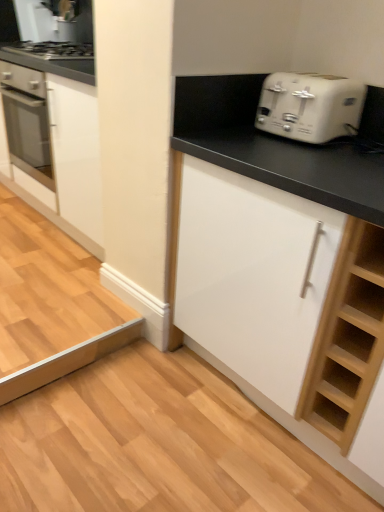
Question: Is there a large distance between white plastic toaster at upper right and white matte cabinet at center, which ranks as the first cabinetry in front-to-back order?

Choices:
 (A) yes
 (B) no

Answer: (B)

Question: Considering the relative positions of white plastic toaster at upper right and white matte cabinet at center, acting as the second cabinetry starting from the back, in the image provided, is white plastic toaster at upper right to the right of white matte cabinet at center, acting as the second cabinetry starting from the back, from the viewer's perspective?

Choices:
 (A) yes
 (B) no

Answer: (B)

Question: Does white plastic toaster at upper right turn towards white matte cabinet at center, arranged as the 2th cabinetry when viewed from the left?

Choices:
 (A) yes
 (B) no

Answer: (B)

Question: Is white plastic toaster at upper right completely or partially outside of white matte cabinet at center, which ranks as the first cabinetry in front-to-back order?

Choices:
 (A) no
 (B) yes

Answer: (B)

Question: Considering the relative sizes of white plastic toaster at upper right and white matte cabinet at center, arranged as the 2th cabinetry when viewed from the left, in the image provided, is white plastic toaster at upper right smaller than white matte cabinet at center, arranged as the 2th cabinetry when viewed from the left,?

Choices:
 (A) no
 (B) yes

Answer: (B)

Question: Is white matte cabinet at center, acting as the second cabinetry starting from the back, situated inside white plastic toaster at upper right or outside?

Choices:
 (A) outside
 (B) inside

Answer: (A)

Question: In terms of height, does white matte cabinet at center, arranged as the 2th cabinetry when viewed from the left, look taller or shorter compared to white plastic toaster at upper right?

Choices:
 (A) tall
 (B) short

Answer: (A)

Question: Is white matte cabinet at center, arranged as the 2th cabinetry when viewed from the left, wider or thinner than white plastic toaster at upper right?

Choices:
 (A) thin
 (B) wide

Answer: (B)

Question: From the image's perspective, is white matte cabinet at center, which ranks as the first cabinetry in front-to-back order, positioned above or below white plastic toaster at upper right?

Choices:
 (A) below
 (B) above

Answer: (A)

Question: In the image, is white glossy cabinet at left, the 1th cabinetry from the back, on the left side or the right side of white plastic toaster at upper right?

Choices:
 (A) right
 (B) left

Answer: (B)

Question: Based on their sizes in the image, would you say white glossy cabinet at left, which is the second cabinetry in front-to-back order, is bigger or smaller than white plastic toaster at upper right?

Choices:
 (A) big
 (B) small

Answer: (A)

Question: From a real-world perspective, relative to white plastic toaster at upper right, is white glossy cabinet at left, which is the second cabinetry in front-to-back order, vertically above or below?

Choices:
 (A) above
 (B) below

Answer: (B)

Question: In terms of width, does white glossy cabinet at left, acting as the 2th cabinetry starting from the right, look wider or thinner when compared to white plastic toaster at upper right?

Choices:
 (A) thin
 (B) wide

Answer: (B)

Question: Looking at the image, does white glossy cabinet at left, the 1th cabinetry from the back, seem bigger or smaller compared to white matte cabinet at center, which ranks as the first cabinetry in front-to-back order?

Choices:
 (A) big
 (B) small

Answer: (B)

Question: Considering their positions, is white glossy cabinet at left, which is the second cabinetry in front-to-back order, located in front of or behind white matte cabinet at center, arranged as the 2th cabinetry when viewed from the left?

Choices:
 (A) behind
 (B) front

Answer: (A)